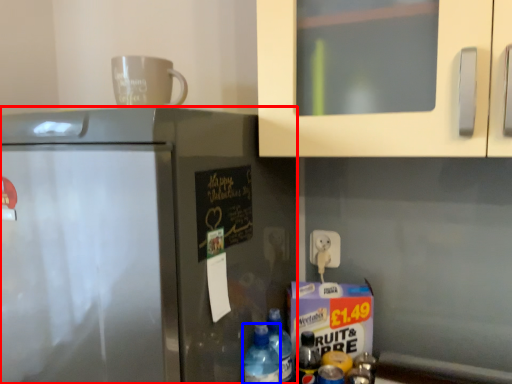
Question: Which object appears farthest to the camera in this image, refrigerator (highlighted by a red box) or bottle (highlighted by a blue box)?

Choices:
 (A) refrigerator
 (B) bottle

Answer: (B)